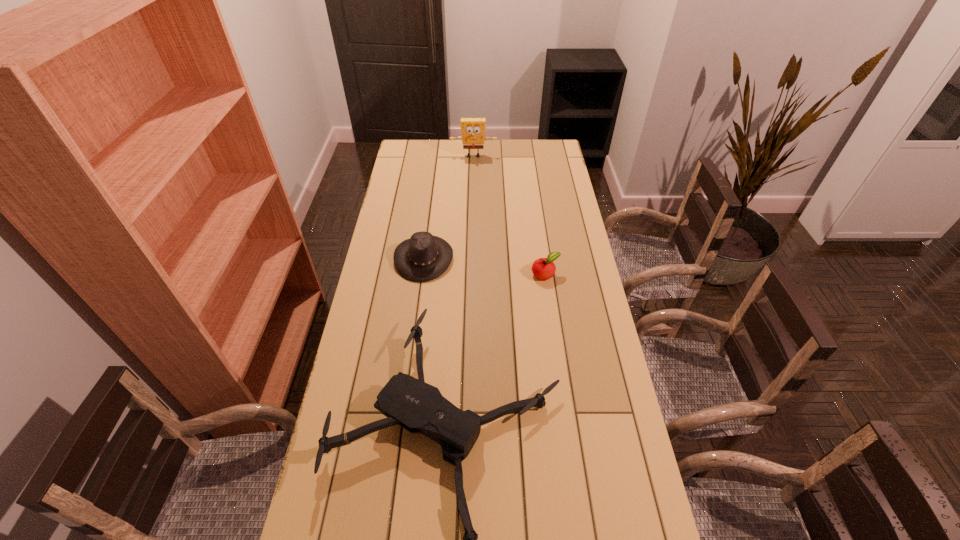
The width and height of the screenshot is (960, 540). I want to click on free location that satisfies the following two spatial constraints: 1. on the front-facing side of the hat; 2. on the left side of the apple, so click(421, 274).

Locate an element on the screen. This screenshot has width=960, height=540. free spot that satisfies the following two spatial constraints: 1. on the face of the shortest object; 2. on the right side of the farthest object is located at coordinates (471, 274).

The height and width of the screenshot is (540, 960). Identify the location of free space that satisfies the following two spatial constraints: 1. on the face of the farthest object; 2. on the front-facing side of the hat. (471, 258).

Identify the location of free space that satisfies the following two spatial constraints: 1. on the front-facing side of the shortest object; 2. on the right side of the hat. The height and width of the screenshot is (540, 960). (421, 274).

Where is `free location that satisfies the following two spatial constraints: 1. on the face of the sponge; 2. on the left side of the shortest object`? free location that satisfies the following two spatial constraints: 1. on the face of the sponge; 2. on the left side of the shortest object is located at coordinates (471, 274).

Where is `free space in the image that satisfies the following two spatial constraints: 1. on the front-facing side of the shortest object; 2. on the left side of the hat`? free space in the image that satisfies the following two spatial constraints: 1. on the front-facing side of the shortest object; 2. on the left side of the hat is located at coordinates (421, 274).

Find the location of a particular element. free space in the image that satisfies the following two spatial constraints: 1. on the front-facing side of the hat; 2. on the back side of the apple is located at coordinates tap(421, 274).